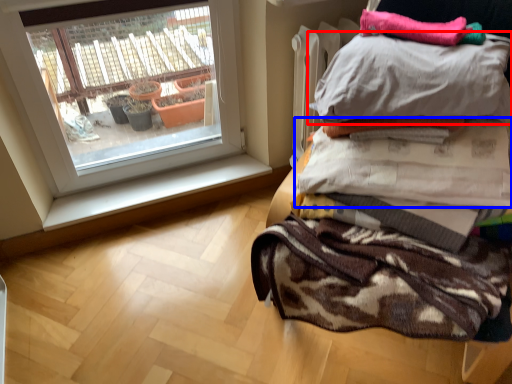
Question: Which of the following is the closest to the observer, pillow (highlighted by a red box) or blanket (highlighted by a blue box)?

Choices:
 (A) pillow
 (B) blanket

Answer: (A)